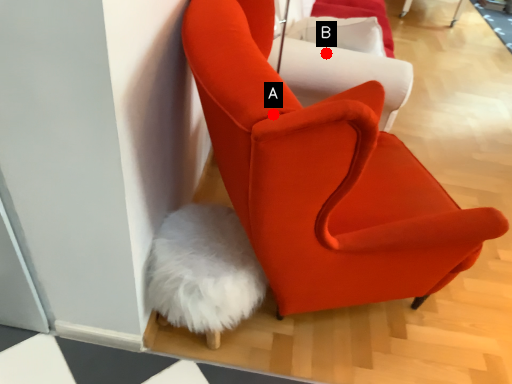
Question: Two points are circled on the image, labeled by A and B beside each circle. Which point appears closest to the camera in this image?

Choices:
 (A) A is closer
 (B) B is closer

Answer: (A)